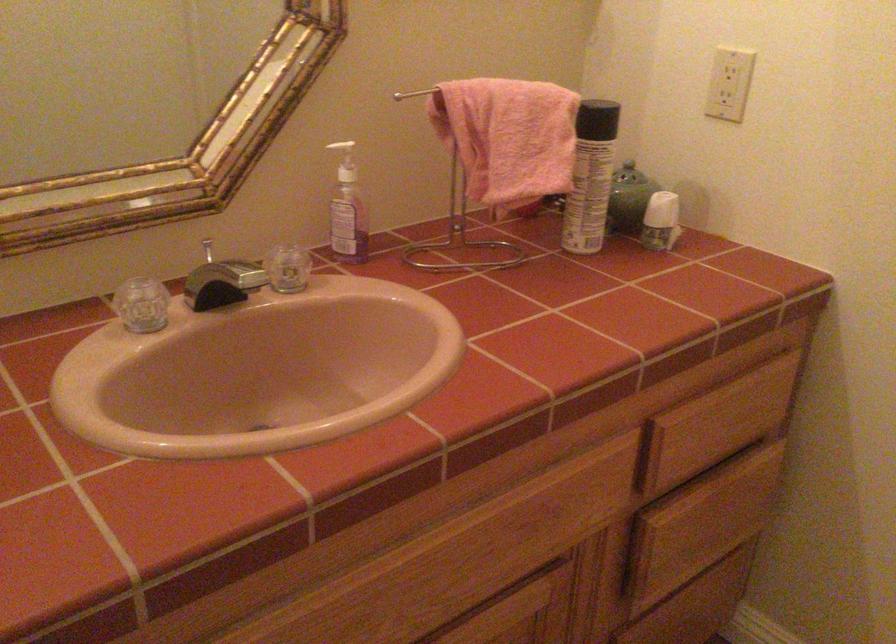
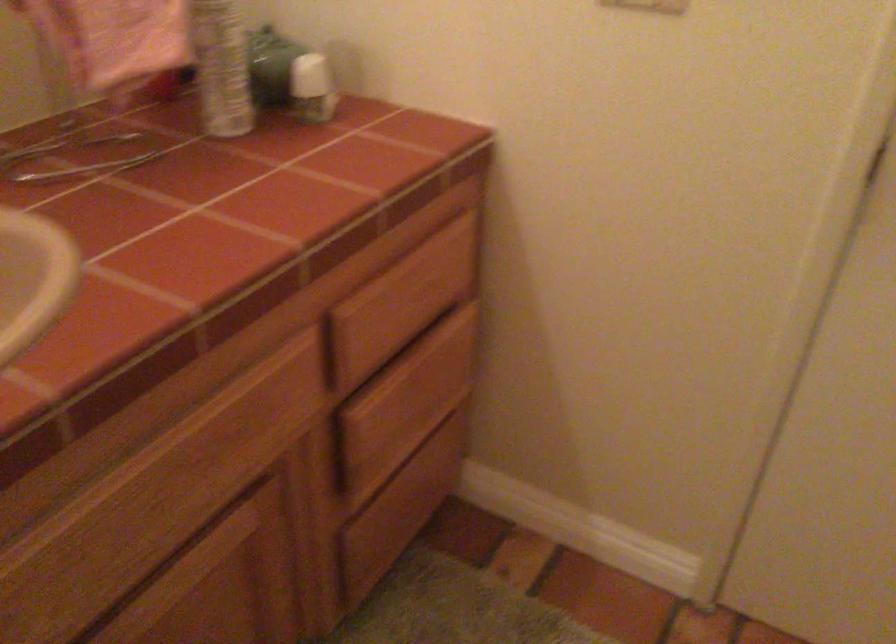
Which direction would the cameraman need to move to produce the second image?

The cameraman moved toward right, forward.